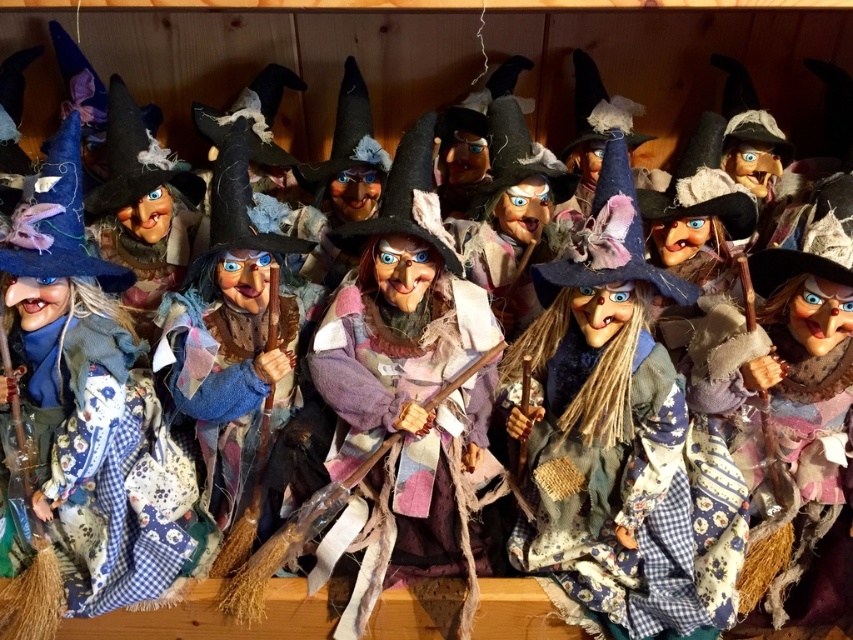
Does patchwork fabric witch at center come behind matte blue fabric witch at left?

No, it is not.

Between patchwork fabric witch at center and matte blue fabric witch at left, which one has more height?

matte blue fabric witch at left is taller.

Who is more distant from viewer, (689, 300) or (154, 476)?

Positioned behind is point (154, 476).

Find the location of `patchwork fabric witch at center`. patchwork fabric witch at center is located at coordinates (614, 436).

I want to click on patchwork fabric witch at center, so click(614, 436).

Can you confirm if patchwork fabric witch at center is shorter than felt witch hat at center?

Incorrect, patchwork fabric witch at center's height does not fall short of felt witch hat at center's.

Is point (630, 532) positioned before point (413, 225)?

No, it is not.

What are the coordinates of `patchwork fabric witch at center` in the screenshot? It's located at (614, 436).

Does matte blue fabric witch at left have a greater height compared to felt witch hat at center?

Yes.

Can you confirm if matte blue fabric witch at left is wider than felt witch hat at center?

Yes.

Describe the element at coordinates (94, 406) in the screenshot. I see `matte blue fabric witch at left` at that location.

This screenshot has width=853, height=640. I want to click on matte blue fabric witch at left, so click(x=94, y=406).